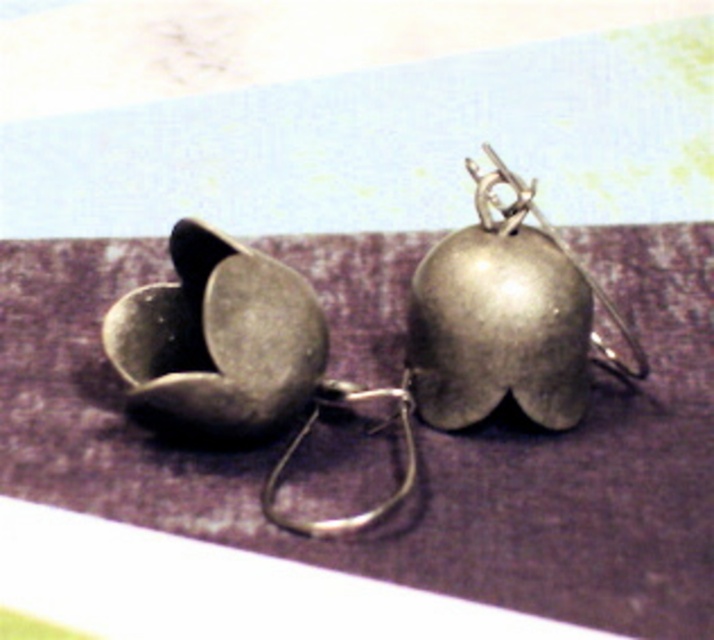
Describe the element at coordinates (416, 445) in the screenshot. I see `metallic purple mat at center` at that location.

Between metallic purple mat at center and polished silver hook at center, which one is positioned higher?

polished silver hook at center is higher up.

Is point (463, 524) less distant than point (531, 211)?

Yes, point (463, 524) is closer to viewer.

You are a GUI agent. You are given a task and a screenshot of the screen. Output one action in this format:
    pyautogui.click(x=<x>, y=<y>)
    Task: Click on the metallic purple mat at center
    
    Given the screenshot: What is the action you would take?
    pyautogui.click(x=416, y=445)

Can you confirm if silver/metallic hook at center is wider than polished silver hook at center?

No.

Between point (377, 429) and point (613, 305), which one is positioned in front?

Positioned in front is point (613, 305).

Is point (311, 524) positioned after point (511, 221)?

No, it is in front of (511, 221).

Locate an element on the screen. The image size is (714, 640). silver/metallic hook at center is located at coordinates (367, 433).

Which is more to the left, metallic purple mat at center or silver/metallic hook at center?

From the viewer's perspective, silver/metallic hook at center appears more on the left side.

Does metallic purple mat at center appear on the right side of silver/metallic hook at center?

Yes, metallic purple mat at center is to the right of silver/metallic hook at center.

Is point (503, 554) positioned after point (333, 520)?

No.

Where is `metallic purple mat at center`? metallic purple mat at center is located at coordinates (416, 445).